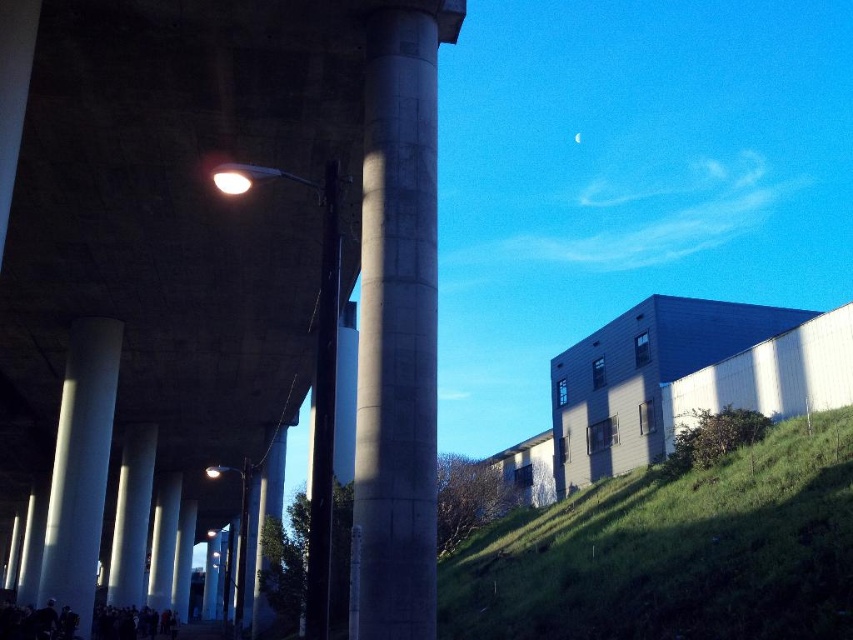
Based on the photo, which is above, concrete at center or white concrete pillar at lower left?

concrete at center is above.

Is point (416, 541) positioned before point (96, 541)?

Yes.

You are a GUI agent. You are given a task and a screenshot of the screen. Output one action in this format:
    pyautogui.click(x=<x>, y=<y>)
    Task: Click on the concrete at center
    This screenshot has height=640, width=853.
    Given the screenshot: What is the action you would take?
    pyautogui.click(x=397, y=326)

Who is positioned more to the left, black glossy pole at center or smooth concrete pillar at center?

smooth concrete pillar at center

Is black glossy pole at center smaller than smooth concrete pillar at center?

No.

At what (x,y) coordinates should I click in order to perform the action: click on black glossy pole at center. Please return your answer as a coordinate pair (x, y). The image size is (853, 640). Looking at the image, I should click on (323, 413).

I want to click on black glossy pole at center, so click(323, 413).

Who is more forward, (x=397, y=336) or (x=366, y=45)?

Point (x=397, y=336) is more forward.

Who is positioned more to the right, concrete at left or concrete at center?

concrete at center is more to the right.

Is point (196, 397) in front of point (436, 100)?

That is False.

Find the location of a particular element. concrete at left is located at coordinates (222, 248).